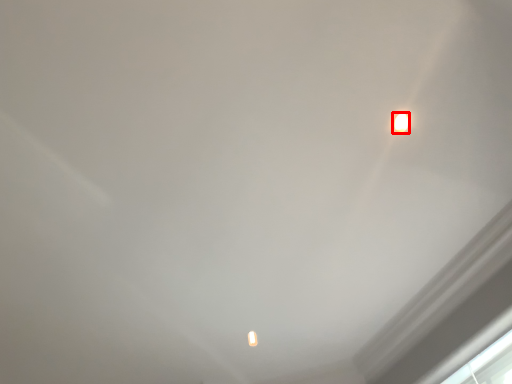
Question: From the image's perspective, where is lamp (annotated by the red box) located in relation to window in the image?

Choices:
 (A) below
 (B) above

Answer: (B)